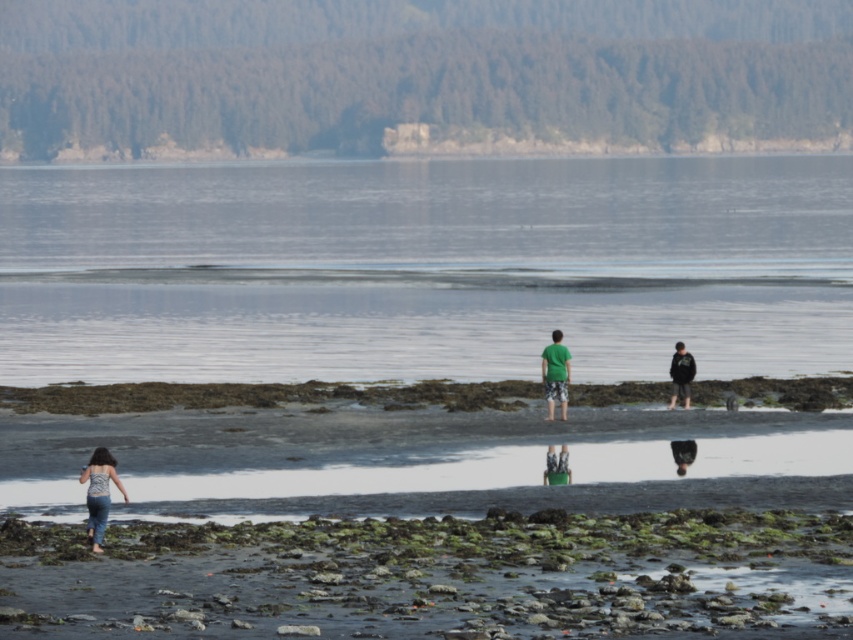
Is clear water at center smaller than green mossy rocks at lower center?

→ No.

Who is lower down, clear water at center or green mossy rocks at lower center?

green mossy rocks at lower center

Does point (635, 198) come closer to viewer compared to point (677, 621)?

That is False.

What are the coordinates of `clear water at center` in the screenshot? It's located at (424, 268).

Between black cotton shirt at right and green fabric shirt at center, which one is positioned lower?

green fabric shirt at center is lower down.

Image resolution: width=853 pixels, height=640 pixels. What do you see at coordinates (682, 374) in the screenshot?
I see `black cotton shirt at right` at bounding box center [682, 374].

The height and width of the screenshot is (640, 853). Describe the element at coordinates (682, 374) in the screenshot. I see `black cotton shirt at right` at that location.

At what (x,y) coordinates should I click in order to perform the action: click on black cotton shirt at right. Please return your answer as a coordinate pair (x, y). This screenshot has height=640, width=853. Looking at the image, I should click on (682, 374).

Who is lower down, clear water at center or green cotton shirt at center?

green cotton shirt at center is below.

Which is above, clear water at center or green cotton shirt at center?

Positioned higher is clear water at center.

Is point (282, 260) behind point (544, 387)?

Yes, point (282, 260) is farther from viewer.

In order to click on clear water at center in this screenshot , I will do click(x=424, y=268).